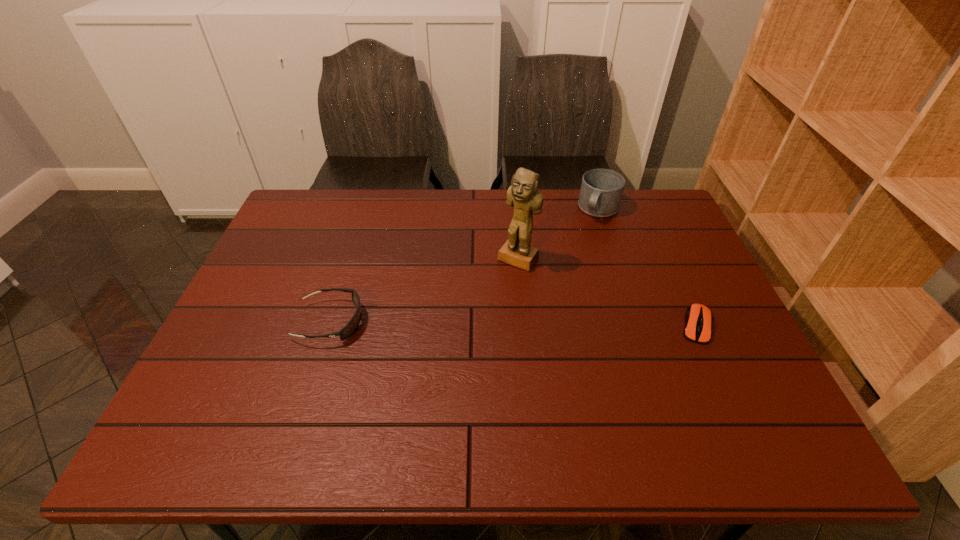
Where is `goggles`? The image size is (960, 540). goggles is located at coordinates (353, 323).

The width and height of the screenshot is (960, 540). Identify the location of the leftmost object. (353, 323).

Find the location of a particular element. the rightmost object is located at coordinates (698, 318).

Find the location of a particular element. The width and height of the screenshot is (960, 540). computer mouse is located at coordinates (698, 318).

This screenshot has width=960, height=540. Identify the location of the second object from right to left. (x=601, y=191).

You are a GUI agent. You are given a task and a screenshot of the screen. Output one action in this format:
    pyautogui.click(x=<x>, y=<y>)
    Task: Click on the farthest object
    The image size is (960, 540).
    Given the screenshot: What is the action you would take?
    pos(601,191)

Where is `the third object from right to left`? This screenshot has width=960, height=540. the third object from right to left is located at coordinates [523, 194].

I want to click on the tallest object, so click(523, 194).

Locate an element on the screen. Image resolution: width=960 pixels, height=540 pixels. vacant space located on the lenses of the goggles is located at coordinates (451, 322).

You are a GUI agent. You are given a task and a screenshot of the screen. Output one action in this format:
    pyautogui.click(x=<x>, y=<y>)
    Task: Click on the free region located on the left of the shortest object
    
    Given the screenshot: What is the action you would take?
    tap(635, 326)